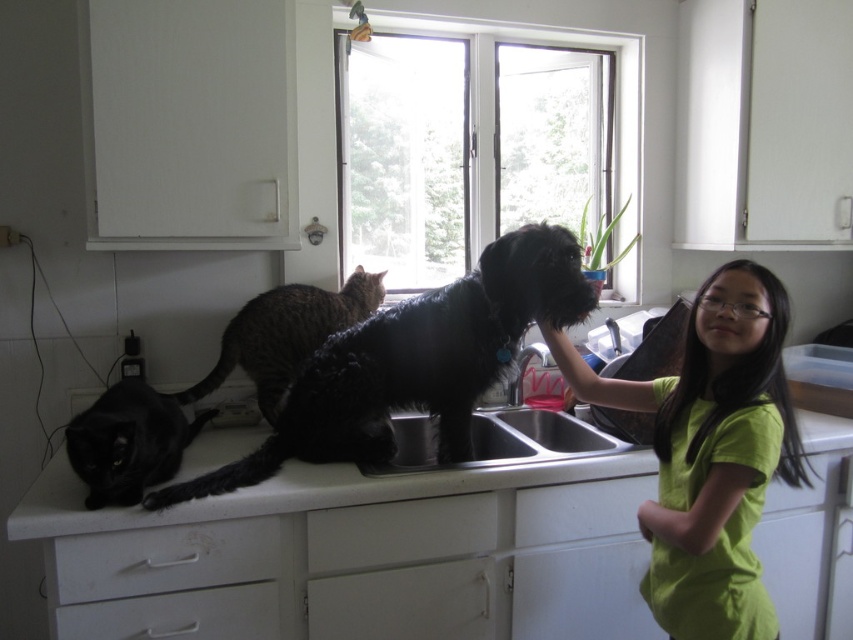
This screenshot has height=640, width=853. Find the location of `dark brown fur cat at center`. dark brown fur cat at center is located at coordinates (415, 362).

Based on the photo, between dark brown fur cat at center and tabby fur cat at center, which one is positioned lower?

dark brown fur cat at center is below.

Who is more forward, [331,355] or [292,284]?

Point [331,355] is more forward.

Locate an element on the screen. The image size is (853, 640). dark brown fur cat at center is located at coordinates (415, 362).

Between white matte drawer at lower left and white matte drawer at lower center, which one is positioned higher?

Positioned higher is white matte drawer at lower center.

Does white matte drawer at lower left have a larger size compared to white matte drawer at lower center?

Correct, white matte drawer at lower left is larger in size than white matte drawer at lower center.

Identify the location of white matte drawer at lower left. The height and width of the screenshot is (640, 853). (165, 557).

Does point (672, 384) lie in front of point (540, 512)?

Yes, it is in front of point (540, 512).

Who is more distant from viewer, [648,595] or [561,532]?

Positioned behind is point [561,532].

Identify the location of green matte shirt at center. (711, 452).

This screenshot has height=640, width=853. Identify the location of green matte shirt at center. (711, 452).